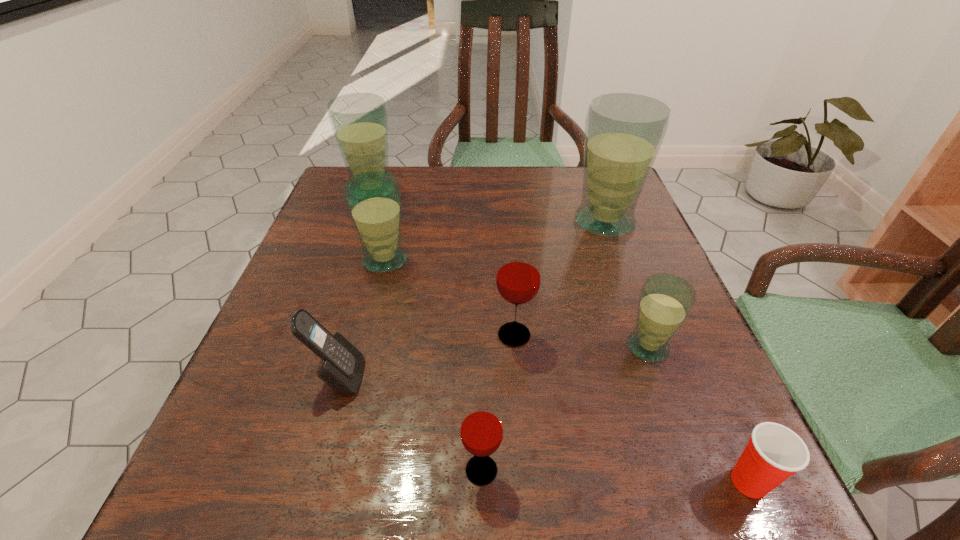
In the image, there is a desktop. Identify the location of free space at the left edge. The width and height of the screenshot is (960, 540). (335, 219).

The width and height of the screenshot is (960, 540). Identify the location of vacant space at the right edge of the desktop. (589, 274).

In the image, there is a desktop. Where is `vacant space at the near left corner`? The height and width of the screenshot is (540, 960). vacant space at the near left corner is located at coordinates (182, 529).

Find the location of `vacant space at the far right corner`. vacant space at the far right corner is located at coordinates (571, 204).

In the image, there is a desktop. Find the location of `free space at the near right corner`. free space at the near right corner is located at coordinates (695, 490).

This screenshot has height=540, width=960. Find the location of `vacant area that lies between the cellular telephone and the nearest blue glass`. vacant area that lies between the cellular telephone and the nearest blue glass is located at coordinates [x=493, y=362].

You are a GUI agent. You are given a task and a screenshot of the screen. Output one action in this format:
    pyautogui.click(x=<x>, y=<y>)
    Task: Click on the blank region between the cellular telephone and the bigger red glass
    
    Given the screenshot: What is the action you would take?
    pyautogui.click(x=426, y=356)

Find the location of `unoccupied position between the farther red glass and the red Dixie cup`. unoccupied position between the farther red glass and the red Dixie cup is located at coordinates (632, 408).

Locate an element on the screen. empty space that is in between the shortest object and the cellular telephone is located at coordinates (544, 429).

This screenshot has width=960, height=540. Find the location of `blank region between the seventh shortest object and the smaller red glass`. blank region between the seventh shortest object and the smaller red glass is located at coordinates (427, 330).